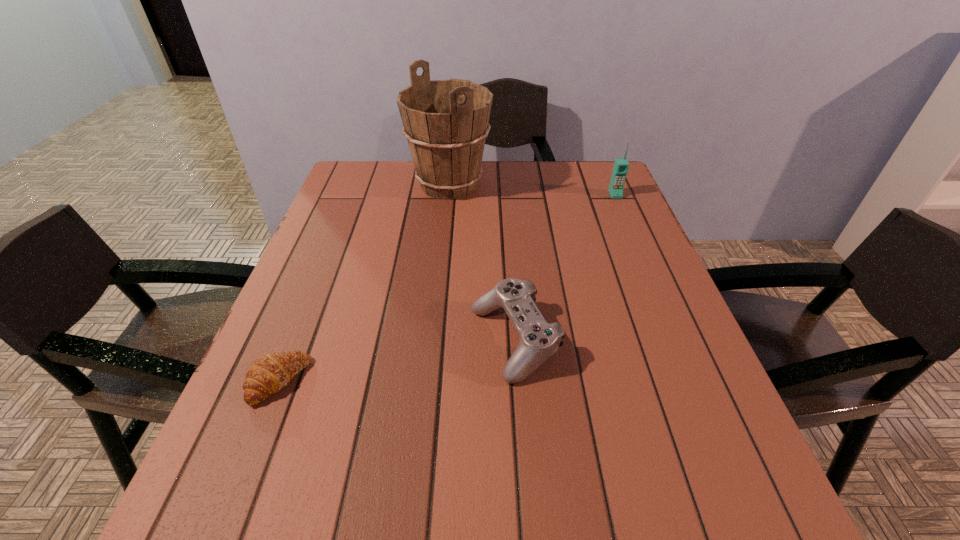
Where is `the tallest object`? This screenshot has width=960, height=540. the tallest object is located at coordinates (446, 122).

What are the coordinates of `the second tallest object` in the screenshot? It's located at (621, 165).

Where is `cellular telephone`? This screenshot has height=540, width=960. cellular telephone is located at coordinates (621, 165).

Locate an element on the screen. control is located at coordinates (539, 340).

The image size is (960, 540). In order to click on the leftmost object in this screenshot , I will do (268, 374).

Locate an element on the screen. This screenshot has width=960, height=540. crescent roll is located at coordinates (268, 374).

Where is `blank area located on the front of the tallest object`? blank area located on the front of the tallest object is located at coordinates (439, 296).

Find the location of a particular element. This screenshot has height=540, width=960. free space located on the keypad of the third shortest object is located at coordinates (631, 230).

This screenshot has height=540, width=960. I want to click on vacant space located 0.130m on the front of the control, so click(x=523, y=456).

The height and width of the screenshot is (540, 960). What are the coordinates of `free space located 0.080m on the front of the shortest object` in the screenshot? It's located at (250, 454).